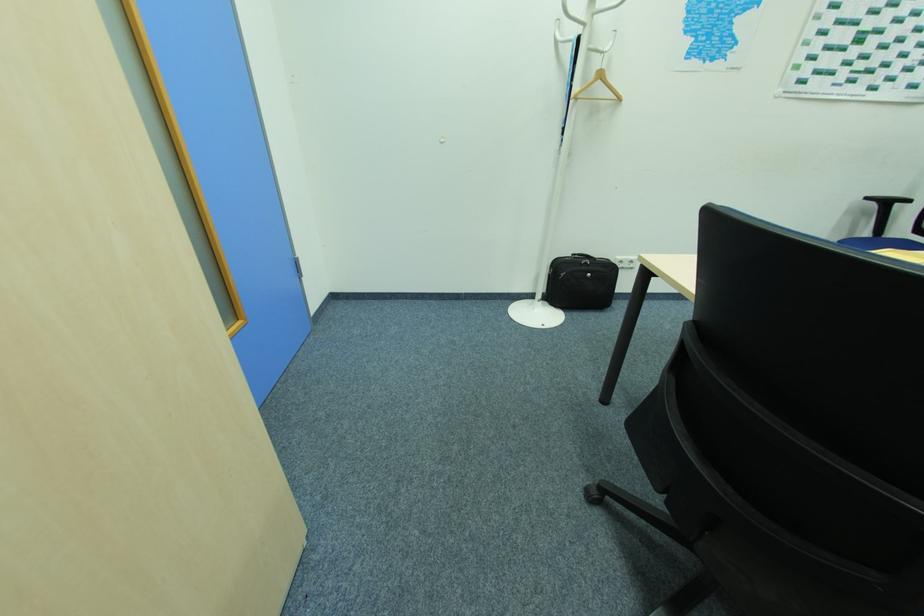
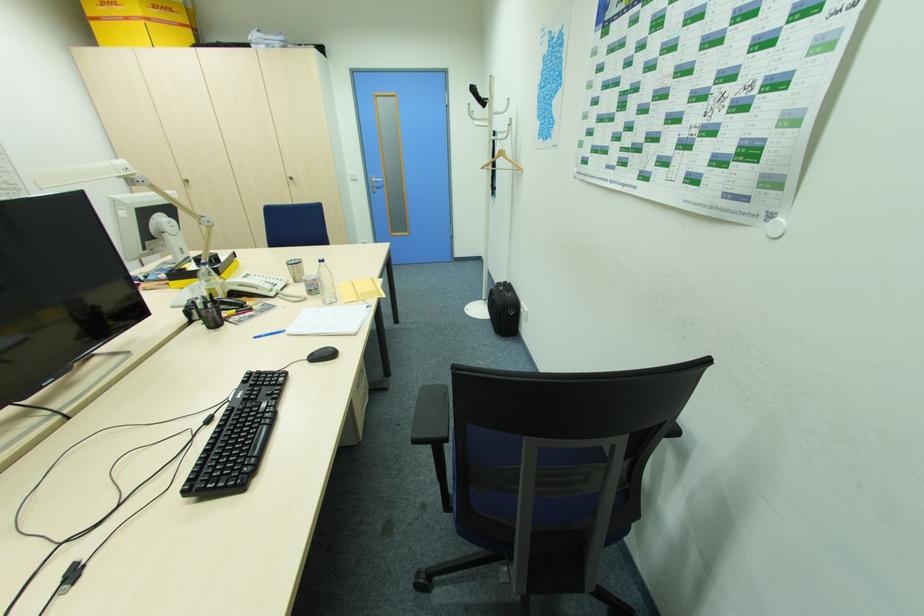
Question: I am providing you with two images of the same scene from different viewpoints. After the viewpoint changes to image2, which objects are now occluded?

Choices:
 (A) white notebook
 (B) paper cup
 (C) black chair armrest
 (D) none of these

Answer: (D)